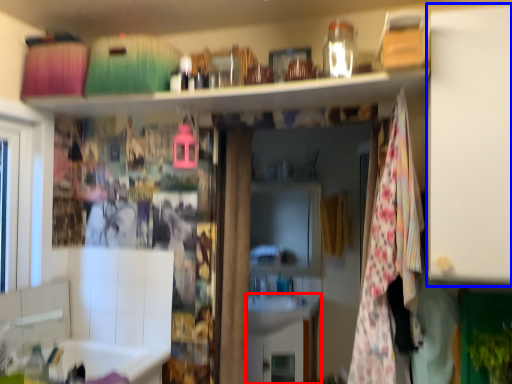
Question: Among these objects, which one is farthest to the camera, cabinetry (highlighted by a red box) or cabinet (highlighted by a blue box)?

Choices:
 (A) cabinetry
 (B) cabinet

Answer: (A)